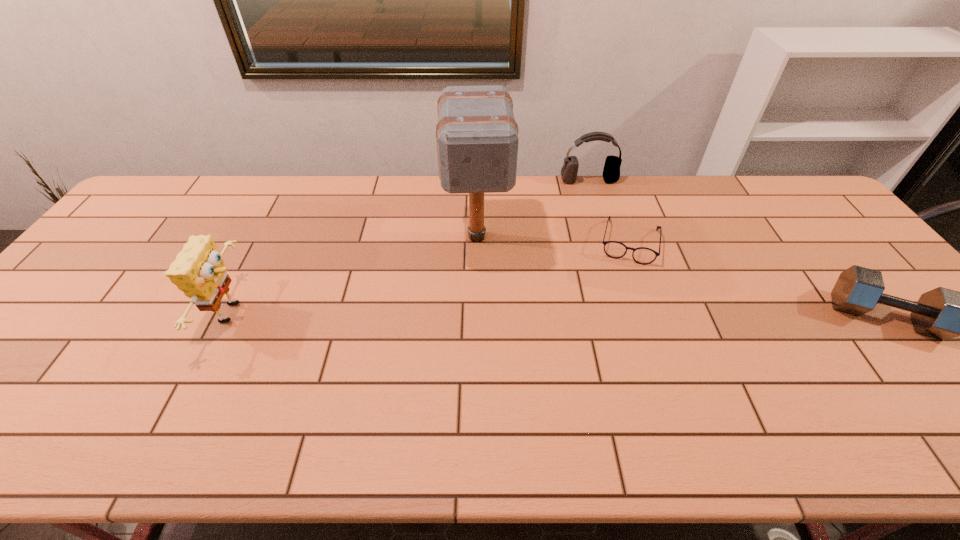
Find the location of a particular element. The image size is (960, 540). free spot at the right edge of the desktop is located at coordinates (831, 240).

Find the location of `free region at the far left corner`. free region at the far left corner is located at coordinates (154, 204).

The image size is (960, 540). In the image, there is a desktop. Identify the location of vacant space at the near left corner. (2, 393).

Where is `free space at the far right corner`? The height and width of the screenshot is (540, 960). free space at the far right corner is located at coordinates tap(796, 207).

In the image, there is a desktop. At what (x,y) coordinates should I click in order to perform the action: click on free space at the near right corner. Please return your answer as a coordinate pair (x, y). This screenshot has height=540, width=960. Looking at the image, I should click on (908, 376).

Find the location of a particular element. Image resolution: width=960 pixels, height=540 pixels. free space between the spectacles and the mallet is located at coordinates (553, 239).

In order to click on free spot between the leftmost object and the tallest object in this screenshot , I will do click(355, 275).

At what (x,y) coordinates should I click in order to perform the action: click on free area in between the shortest object and the third tallest object. Please return your answer as a coordinate pair (x, y). Looking at the image, I should click on (609, 211).

Identify the location of blank region between the tallest object and the shortest object. The image size is (960, 540). (553, 239).

The width and height of the screenshot is (960, 540). I want to click on free spot between the leftmost object and the third tallest object, so click(x=411, y=247).